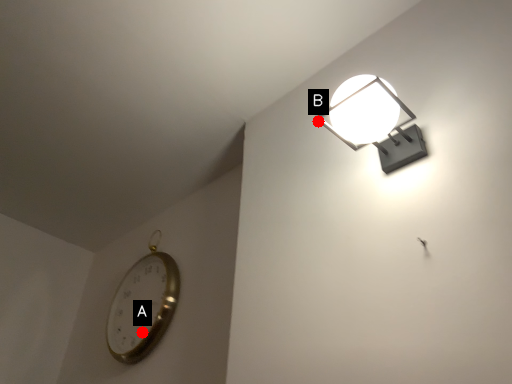
Question: Two points are circled on the image, labeled by A and B beside each circle. Which point appears farthest from the camera in this image?

Choices:
 (A) A is further
 (B) B is further

Answer: (A)